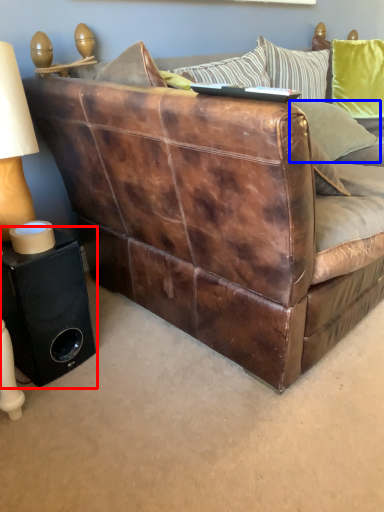
Question: Which point is further to the camera, speaker (highlighted by a red box) or pillow (highlighted by a blue box)?

Choices:
 (A) speaker
 (B) pillow

Answer: (B)